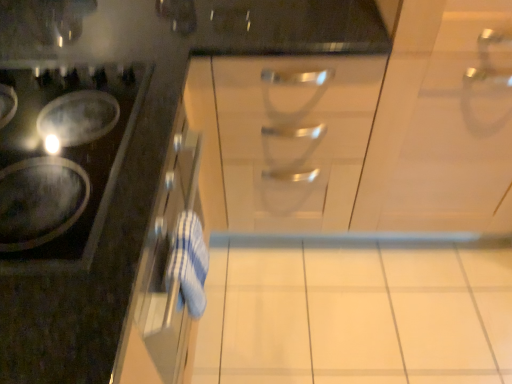
Where is `white glossy tile at center`? The image size is (512, 384). white glossy tile at center is located at coordinates (367, 312).

In order to face shiny black cooktop at left, should I rotate leftwards or rightwards?

Turn left approximately 28.424 degrees to face it.

What is the approximate height of shiny black cooktop at left?

shiny black cooktop at left is 3.08 inches in height.

You are a GUI agent. You are given a task and a screenshot of the screen. Output one action in this format:
    pyautogui.click(x=<x>, y=<y>)
    Task: Click on the white glossy cabinet at center, the first cabinetry positioned from the right
    
    Given the screenshot: What is the action you would take?
    (442, 122)

I want to click on white glossy cabinet at upper left, the 2th cabinetry when ordered from right to left, so click(106, 174).

Looking at this image, are satin silver drawer at center and white glossy cabinet at center, which is the second cabinetry in left-to-right order, far apart?

No, satin silver drawer at center is not far from white glossy cabinet at center, which is the second cabinetry in left-to-right order.

Is satin silver drawer at center closer to camera compared to white glossy cabinet at center, the first cabinetry positioned from the right?

No, the depth of satin silver drawer at center is greater than that of white glossy cabinet at center, the first cabinetry positioned from the right.

In the scene shown: Is satin silver drawer at center positioned with its back to white glossy cabinet at center, which is the second cabinetry in left-to-right order?

No, satin silver drawer at center is not facing away from white glossy cabinet at center, which is the second cabinetry in left-to-right order.

Is white glossy cabinet at center, which is the second cabinetry in left-to-right order, to the left or to the right of white glossy cabinet at upper left, positioned as the first cabinetry in left-to-right order, in the image?

white glossy cabinet at center, which is the second cabinetry in left-to-right order, is positioned on white glossy cabinet at upper left, positioned as the first cabinetry in left-to-right order,'s right side.

Would you say white glossy cabinet at center, the first cabinetry positioned from the right, is outside white glossy cabinet at upper left, positioned as the first cabinetry in left-to-right order?

Indeed, white glossy cabinet at center, the first cabinetry positioned from the right, is completely outside white glossy cabinet at upper left, positioned as the first cabinetry in left-to-right order.

Who is smaller, white glossy cabinet at center, which is the second cabinetry in left-to-right order, or white glossy cabinet at upper left, the 2th cabinetry when ordered from right to left?

white glossy cabinet at upper left, the 2th cabinetry when ordered from right to left, is smaller.

Does satin silver drawer at center have a lesser width compared to white glossy cabinet at upper left, positioned as the first cabinetry in left-to-right order?

In fact, satin silver drawer at center might be wider than white glossy cabinet at upper left, positioned as the first cabinetry in left-to-right order.

This screenshot has width=512, height=384. Find the location of `the 2nd cabinetry directly above the satin silver drawer at center (from a real-world perspective)`. the 2nd cabinetry directly above the satin silver drawer at center (from a real-world perspective) is located at coordinates (106, 174).

In terms of size, does satin silver drawer at center appear bigger or smaller than white glossy cabinet at upper left, positioned as the first cabinetry in left-to-right order?

Clearly, satin silver drawer at center is larger in size than white glossy cabinet at upper left, positioned as the first cabinetry in left-to-right order.

From the image's perspective, which one is positioned higher, satin silver drawer at center or white glossy cabinet at upper left, positioned as the first cabinetry in left-to-right order?

satin silver drawer at center.

What's the angular difference between white glossy cabinet at center, which is the second cabinetry in left-to-right order, and shiny black cooktop at left's facing directions?

90.3 degrees separate the facing orientations of white glossy cabinet at center, which is the second cabinetry in left-to-right order, and shiny black cooktop at left.

Find the location of a particular element. gas stove below the white glossy cabinet at center, the first cabinetry positioned from the right (from the image's perspective) is located at coordinates (63, 162).

From the image's perspective, is white glossy cabinet at center, which is the second cabinetry in left-to-right order, on top of shiny black cooktop at left?

Yes, from the image's perspective, white glossy cabinet at center, which is the second cabinetry in left-to-right order, is on top of shiny black cooktop at left.

Considering the relative sizes of shiny black cooktop at left and white glossy cabinet at upper left, positioned as the first cabinetry in left-to-right order, in the image provided, is shiny black cooktop at left thinner than white glossy cabinet at upper left, positioned as the first cabinetry in left-to-right order,?

Yes.

Where is `gas stove above the white glossy cabinet at upper left, positioned as the first cabinetry in left-to-right order (from the image's perspective)`? gas stove above the white glossy cabinet at upper left, positioned as the first cabinetry in left-to-right order (from the image's perspective) is located at coordinates (63, 162).

Can you confirm if shiny black cooktop at left is positioned to the right of white glossy cabinet at upper left, the 2th cabinetry when ordered from right to left?

No, shiny black cooktop at left is not to the right of white glossy cabinet at upper left, the 2th cabinetry when ordered from right to left.

How far apart are shiny black cooktop at left and white glossy cabinet at upper left, positioned as the first cabinetry in left-to-right order?

shiny black cooktop at left and white glossy cabinet at upper left, positioned as the first cabinetry in left-to-right order, are 3.53 inches apart.

Considering the sizes of objects white glossy tile at center and white glossy cabinet at upper left, positioned as the first cabinetry in left-to-right order, in the image provided, who is thinner, white glossy tile at center or white glossy cabinet at upper left, positioned as the first cabinetry in left-to-right order,?

white glossy cabinet at upper left, positioned as the first cabinetry in left-to-right order, is thinner.

In terms of height, does white glossy tile at center look taller or shorter compared to white glossy cabinet at upper left, positioned as the first cabinetry in left-to-right order?

Clearly, white glossy tile at center is shorter compared to white glossy cabinet at upper left, positioned as the first cabinetry in left-to-right order.

Does point (318, 254) come behind point (89, 30)?

Yes, it is behind point (89, 30).

Is white glossy tile at center bigger or smaller than white glossy cabinet at upper left, positioned as the first cabinetry in left-to-right order?

Considering their sizes, white glossy tile at center takes up less space than white glossy cabinet at upper left, positioned as the first cabinetry in left-to-right order.

From the image's perspective, is satin silver drawer at center above or below white glossy tile at center?

Based on their image positions, satin silver drawer at center is located above white glossy tile at center.

Which is closer to the camera, (323, 60) or (396, 321)?

The point (323, 60) is more forward.

Is satin silver drawer at center in front of or behind white glossy tile at center in the image?

satin silver drawer at center is positioned closer to the viewer than white glossy tile at center.

Choose the correct answer: Is satin silver drawer at center inside white glossy tile at center or outside it?

satin silver drawer at center is outside white glossy tile at center.

Locate an element on the screen. the 1st cabinetry directly above the satin silver drawer at center (from a real-world perspective) is located at coordinates (442, 122).

The image size is (512, 384). I want to click on cabinetry below the white glossy cabinet at upper left, positioned as the first cabinetry in left-to-right order (from a real-world perspective), so click(442, 122).

From the image, which object appears to be nearer to white glossy cabinet at upper left, the 2th cabinetry when ordered from right to left, white glossy cabinet at center, which is the second cabinetry in left-to-right order, or shiny black cooktop at left?

shiny black cooktop at left is positioned closer to the anchor white glossy cabinet at upper left, the 2th cabinetry when ordered from right to left.

Based on their spatial positions, is shiny black cooktop at left or white glossy cabinet at upper left, the 2th cabinetry when ordered from right to left, closer to white glossy tile at center?

white glossy cabinet at upper left, the 2th cabinetry when ordered from right to left, lies closer to white glossy tile at center than the other object.

When comparing their distances from shiny black cooktop at left, does white glossy cabinet at center, the first cabinetry positioned from the right, or white glossy cabinet at upper left, the 2th cabinetry when ordered from right to left, seem closer?

white glossy cabinet at upper left, the 2th cabinetry when ordered from right to left, lies closer to shiny black cooktop at left than the other object.

From the image, which object appears to be farther from white glossy tile at center, white glossy cabinet at upper left, the 2th cabinetry when ordered from right to left, or white glossy cabinet at center, the first cabinetry positioned from the right?

white glossy cabinet at upper left, the 2th cabinetry when ordered from right to left, is further to white glossy tile at center.

When comparing their distances from shiny black cooktop at left, does satin silver drawer at center or white glossy cabinet at center, the first cabinetry positioned from the right, seem further?

Among the two, white glossy cabinet at center, the first cabinetry positioned from the right, is located further to shiny black cooktop at left.

Based on their spatial positions, is white glossy cabinet at upper left, positioned as the first cabinetry in left-to-right order, or shiny black cooktop at left closer to white glossy cabinet at center, which is the second cabinetry in left-to-right order?

white glossy cabinet at upper left, positioned as the first cabinetry in left-to-right order, lies closer to white glossy cabinet at center, which is the second cabinetry in left-to-right order, than the other object.

Consider the image. When comparing their distances from white glossy cabinet at upper left, the 2th cabinetry when ordered from right to left, does white glossy cabinet at center, which is the second cabinetry in left-to-right order, or white glossy tile at center seem closer?

Based on the image, white glossy cabinet at center, which is the second cabinetry in left-to-right order, appears to be nearer to white glossy cabinet at upper left, the 2th cabinetry when ordered from right to left.

Estimate the real-world distances between objects in this image. Which object is further from white glossy cabinet at upper left, the 2th cabinetry when ordered from right to left, shiny black cooktop at left or satin silver drawer at center?

Based on the image, satin silver drawer at center appears to be further to white glossy cabinet at upper left, the 2th cabinetry when ordered from right to left.

Where is `ceramic tile located between white glossy cabinet at upper left, the 2th cabinetry when ordered from right to left, and white glossy cabinet at center, which is the second cabinetry in left-to-right order, in the left-right direction`? ceramic tile located between white glossy cabinet at upper left, the 2th cabinetry when ordered from right to left, and white glossy cabinet at center, which is the second cabinetry in left-to-right order, in the left-right direction is located at coordinates (367, 312).

This screenshot has height=384, width=512. In order to click on cabinetry situated between shiny black cooktop at left and white glossy cabinet at center, the first cabinetry positioned from the right, from left to right in this screenshot , I will do `click(106, 174)`.

What are the coordinates of `cabinetry between shiny black cooktop at left and satin silver drawer at center in the horizontal direction` in the screenshot? It's located at (106, 174).

Locate an element on the screen. cabinetry between shiny black cooktop at left and white glossy tile at center from left to right is located at coordinates (106, 174).